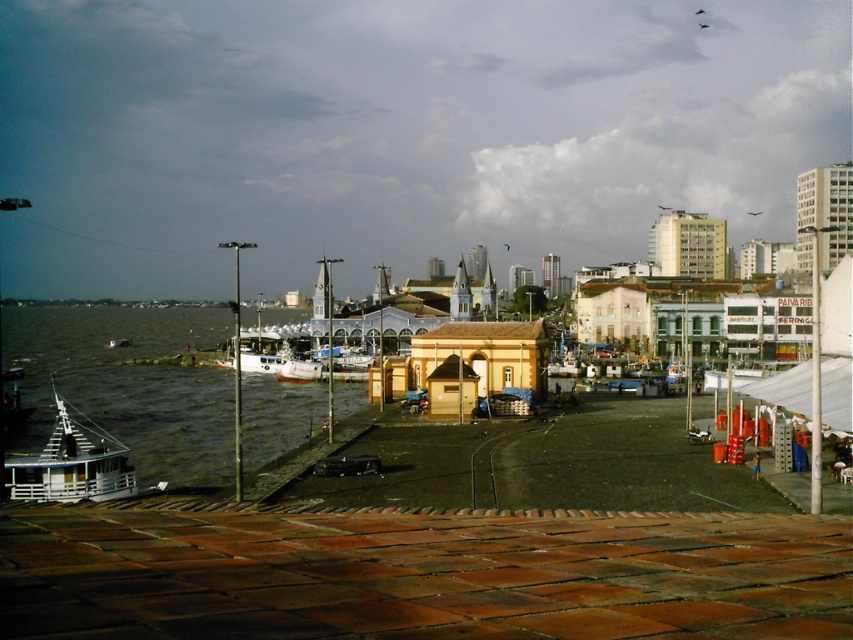
You are standing on the paved walkway and want to reach the boats. Which direction should you head from the brown wooden dock at lower center to reach the greenish water at lower left where the boats are docked?

Since the brown wooden dock at lower center is to the right of the greenish water at lower left, you should head to the left from the brown wooden dock at lower center to reach the greenish water at lower left where the boats are docked.

You are standing on the paved walkway and want to reach the boats docked at the waterfront. Which object should you pass in front of first, the brown wooden dock at lower center or the greenish water at lower left?

The brown wooden dock at lower center is in front of the greenish water at lower left. Since you are on the paved walkway, you would first pass in front of the brown wooden dock at lower center before reaching the greenish water at lower left, which is behind it.